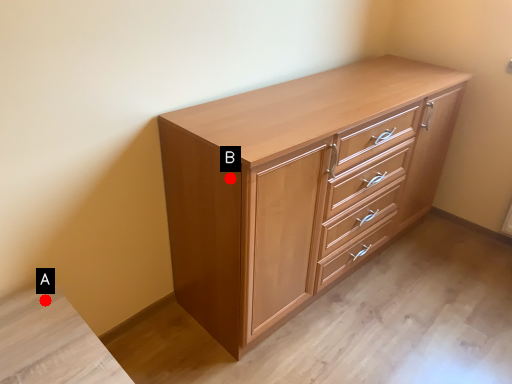
Question: Two points are circled on the image, labeled by A and B beside each circle. Which point is closer to the camera taking this photo?

Choices:
 (A) A is closer
 (B) B is closer

Answer: (B)